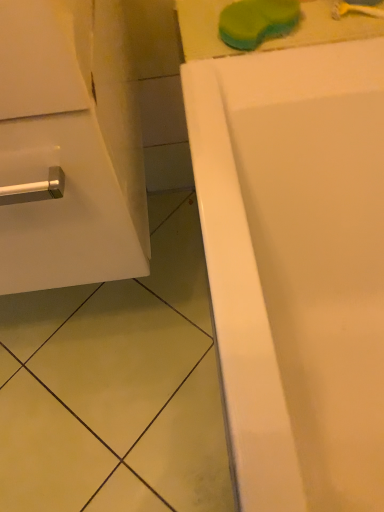
Question: Relative to white glossy cabinet at left, is green sponge at upper center in front or behind?

Choices:
 (A) behind
 (B) front

Answer: (A)

Question: Looking at their shapes, would you say green sponge at upper center is wider or thinner than white glossy cabinet at left?

Choices:
 (A) wide
 (B) thin

Answer: (B)

Question: Considering the real-world distances, which object is farthest from the yellow plastic toothbrush at upper right?

Choices:
 (A) green sponge at upper center
 (B) white glossy cabinet at left

Answer: (B)

Question: Which object is the farthest from the yellow plastic toothbrush at upper right?

Choices:
 (A) white glossy cabinet at left
 (B) green sponge at upper center

Answer: (A)